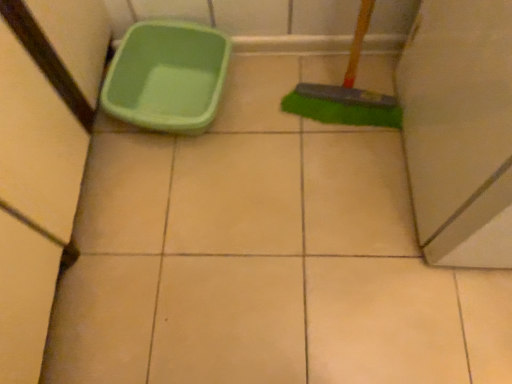
Where is `vacant area situated below green plastic tray at upper left (from a real-world perspective)`? vacant area situated below green plastic tray at upper left (from a real-world perspective) is located at coordinates (178, 101).